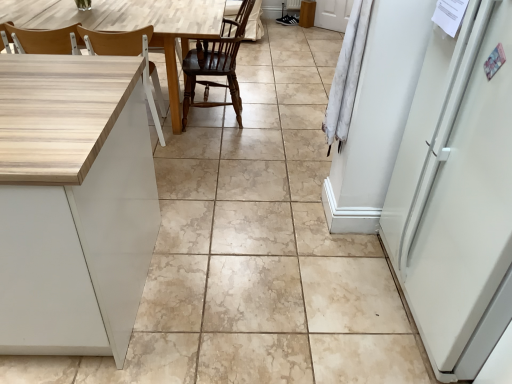
The height and width of the screenshot is (384, 512). What do you see at coordinates (130, 55) in the screenshot? I see `wooden at left, which appears as the second chair when viewed from the right` at bounding box center [130, 55].

Locate an element on the screen. This screenshot has height=384, width=512. dark wood chair at center, which is the first chair from right to left is located at coordinates (214, 67).

You are a GUI agent. You are given a task and a screenshot of the screen. Output one action in this format:
    pyautogui.click(x=<x>, y=<y>)
    Task: Click on the light wood table at left
    
    Given the screenshot: What is the action you would take?
    pyautogui.click(x=129, y=25)

Which of these two, wooden at left, which appears as the second chair when viewed from the right, or light wood table at left, stands shorter?

Standing shorter between the two is light wood table at left.

Could you tell me if wooden at left, the 1th chair viewed from the left, is turned towards light wood table at left?

Yes, wooden at left, the 1th chair viewed from the left, is turned towards light wood table at left.

Which object is thinner, wooden at left, the 1th chair viewed from the left, or light wood table at left?

wooden at left, the 1th chair viewed from the left, is thinner.

Could you tell me if light wood table at left is turned towards dark wood chair at center, the second chair from the left?

No, light wood table at left is not aimed at dark wood chair at center, the second chair from the left.

Is light wood table at left far from dark wood chair at center, the second chair from the left?

light wood table at left is near dark wood chair at center, the second chair from the left, not far away.

Can you confirm if light wood table at left is wider than dark wood chair at center, the second chair from the left?

Yes, light wood table at left is wider than dark wood chair at center, the second chair from the left.

The height and width of the screenshot is (384, 512). I want to click on table lying above the dark wood chair at center, the second chair from the left (from the image's perspective), so click(x=129, y=25).

Which object is positioned more to the right, dark wood chair at center, the second chair from the left, or light wood table at left?

dark wood chair at center, the second chair from the left, is more to the right.

Is light wood table at left located within dark wood chair at center, which is the first chair from right to left?

No, dark wood chair at center, which is the first chair from right to left, does not contain light wood table at left.

How many degrees apart are the facing directions of dark wood chair at center, which is the first chair from right to left, and light wood table at left?

There is a 88.1-degree angle between the facing directions of dark wood chair at center, which is the first chair from right to left, and light wood table at left.

Is dark wood chair at center, the second chair from the left, not near light wood table at left?

No, dark wood chair at center, the second chair from the left, is in close proximity to light wood table at left.

Is light wood table at left aimed at wooden at left, the 1th chair viewed from the left?

Yes, light wood table at left faces towards wooden at left, the 1th chair viewed from the left.

Considering the relative positions of light wood table at left and wooden at left, the 1th chair viewed from the left, in the image provided, is light wood table at left to the right of wooden at left, the 1th chair viewed from the left, from the viewer's perspective?

Incorrect, light wood table at left is not on the right side of wooden at left, the 1th chair viewed from the left.

Is light wood table at left spatially inside wooden at left, which appears as the second chair when viewed from the right, or outside of it?

light wood table at left lies outside wooden at left, which appears as the second chair when viewed from the right.

Considering the relative sizes of light wood table at left and wooden at left, which appears as the second chair when viewed from the right, in the image provided, is light wood table at left wider than wooden at left, which appears as the second chair when viewed from the right,?

Yes, light wood table at left is wider than wooden at left, which appears as the second chair when viewed from the right.

Does point (154, 115) lie in front of point (182, 129)?

That is True.

Between wooden at left, the 1th chair viewed from the left, and dark wood chair at center, which is the first chair from right to left, which one has larger size?

Bigger between the two is dark wood chair at center, which is the first chair from right to left.

From a real-world perspective, is wooden at left, which appears as the second chair when viewed from the right, positioned over dark wood chair at center, the second chair from the left, based on gravity?

Actually, wooden at left, which appears as the second chair when viewed from the right, is physically below dark wood chair at center, the second chair from the left, in the real world.

Does wooden at left, which appears as the second chair when viewed from the right, appear on the left side of dark wood chair at center, the second chair from the left?

Indeed, wooden at left, which appears as the second chair when viewed from the right, is positioned on the left side of dark wood chair at center, the second chair from the left.

From the image's perspective, relative to wooden at left, which appears as the second chair when viewed from the right, is dark wood chair at center, the second chair from the left, above or below?

dark wood chair at center, the second chair from the left, is above wooden at left, which appears as the second chair when viewed from the right.

Which of these two, dark wood chair at center, which is the first chair from right to left, or wooden at left, the 1th chair viewed from the left, stands taller?

dark wood chair at center, which is the first chair from right to left.

Where is `the 2nd chair below the light wood table at left (from the image's perspective)`? The height and width of the screenshot is (384, 512). the 2nd chair below the light wood table at left (from the image's perspective) is located at coordinates (130, 55).

At what (x,y) coordinates should I click in order to perform the action: click on table that is on the left side of dark wood chair at center, which is the first chair from right to left. Please return your answer as a coordinate pair (x, y). Image resolution: width=512 pixels, height=384 pixels. Looking at the image, I should click on (129, 25).

Based on their spatial positions, is dark wood chair at center, which is the first chair from right to left, or light wood table at left closer to wooden at left, the 1th chair viewed from the left?

The object closer to wooden at left, the 1th chair viewed from the left, is light wood table at left.

When comparing their distances from light wood table at left, does dark wood chair at center, the second chair from the left, or wooden at left, the 1th chair viewed from the left, seem further?

dark wood chair at center, the second chair from the left, lies further to light wood table at left than the other object.

Consider the image. When comparing their distances from dark wood chair at center, the second chair from the left, does wooden at left, the 1th chair viewed from the left, or light wood table at left seem further?

Based on the image, wooden at left, the 1th chair viewed from the left, appears to be further to dark wood chair at center, the second chair from the left.

Looking at the image, which one is located closer to light wood table at left, wooden at left, the 1th chair viewed from the left, or dark wood chair at center, which is the first chair from right to left?

Based on the image, wooden at left, the 1th chair viewed from the left, appears to be nearer to light wood table at left.

Based on the photo, considering their positions, is light wood table at left positioned further to dark wood chair at center, which is the first chair from right to left, than wooden at left, which appears as the second chair when viewed from the right?

Based on the image, wooden at left, which appears as the second chair when viewed from the right, appears to be further to dark wood chair at center, which is the first chair from right to left.

Estimate the real-world distances between objects in this image. Which object is closer to wooden at left, the 1th chair viewed from the left, light wood table at left or dark wood chair at center, which is the first chair from right to left?

Among the two, light wood table at left is located nearer to wooden at left, the 1th chair viewed from the left.

Locate an element on the screen. chair between light wood table at left and dark wood chair at center, the second chair from the left, in the horizontal direction is located at coordinates (130, 55).